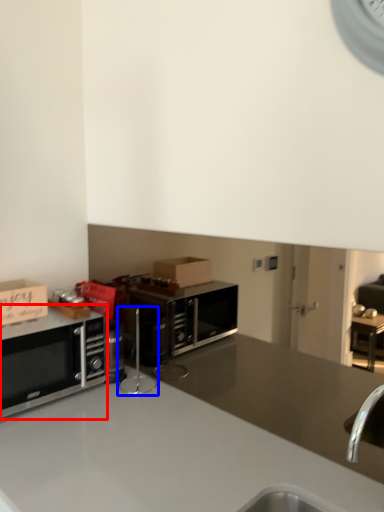
Question: Among these objects, which one is nearest to the camera, microwave oven (highlighted by a red box) or appliance (highlighted by a blue box)?

Choices:
 (A) microwave oven
 (B) appliance

Answer: (A)